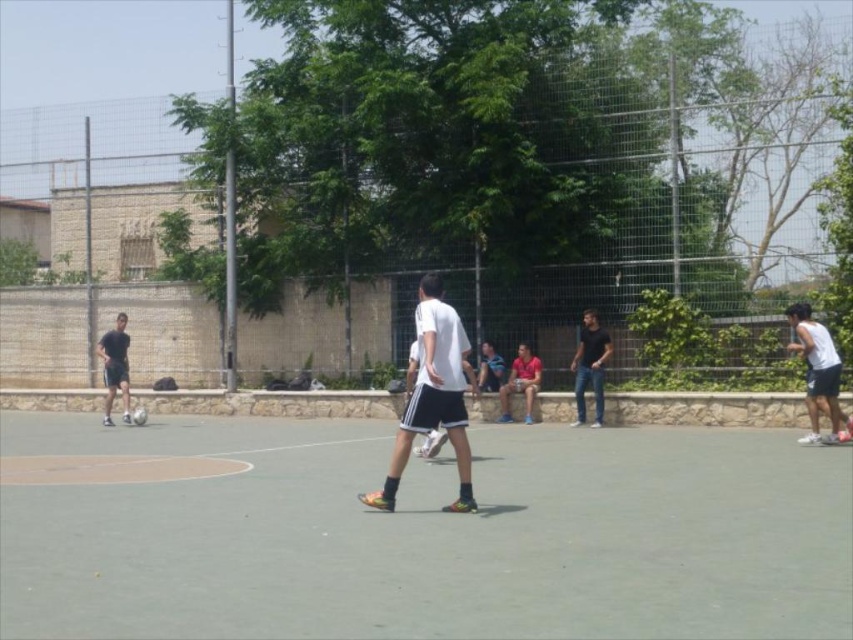
This screenshot has width=853, height=640. What do you see at coordinates (433, 396) in the screenshot?
I see `white matte shorts at center` at bounding box center [433, 396].

In order to click on white matte shorts at center in this screenshot , I will do `click(433, 396)`.

Between point (450, 308) and point (599, 422), which one is positioned in front?

Point (450, 308) is in front.

At what (x,y) coordinates should I click in order to perform the action: click on white matte shorts at center. Please return your answer as a coordinate pair (x, y). Image resolution: width=853 pixels, height=640 pixels. Looking at the image, I should click on (433, 396).

Who is more distant from viewer, (447, 506) or (107, 417)?

The point (107, 417) is more distant.

Is point (427, 404) farther from camera compared to point (128, 422)?

No, it is in front of (128, 422).

Between point (465, 417) and point (126, 404), which one is positioned in front?

Point (465, 417) is in front.

Find the location of a particular element. The width and height of the screenshot is (853, 640). white matte shorts at center is located at coordinates (433, 396).

Measure the distance from green rubber court at center to white matte shorts at center.

green rubber court at center is 2.56 meters away from white matte shorts at center.

Does green rubber court at center appear over white matte shorts at center?

No.

Find the location of a particular element. The image size is (853, 640). green rubber court at center is located at coordinates (428, 534).